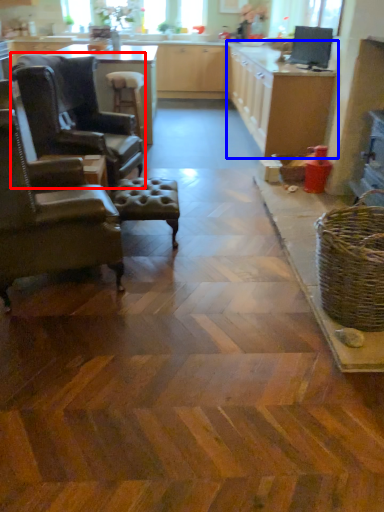
Question: Which of the following is the closest to the observer, chair (highlighted by a red box) or cabinetry (highlighted by a blue box)?

Choices:
 (A) chair
 (B) cabinetry

Answer: (A)